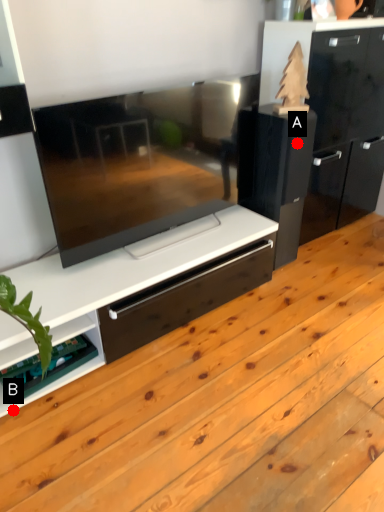
Question: Two points are circled on the image, labeled by A and B beside each circle. Which point appears closest to the camera in this image?

Choices:
 (A) A is closer
 (B) B is closer

Answer: (B)